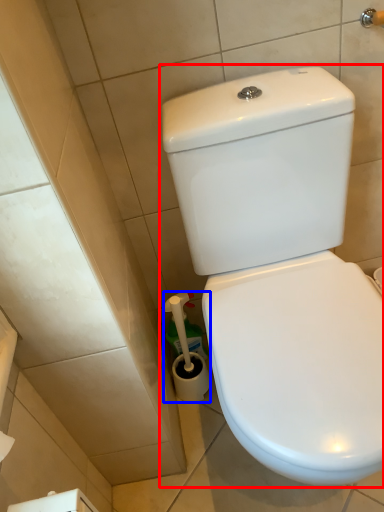
Question: Which point is closer to the camera, toilet (highlighted by a red box) or brush (highlighted by a blue box)?

Choices:
 (A) toilet
 (B) brush

Answer: (A)